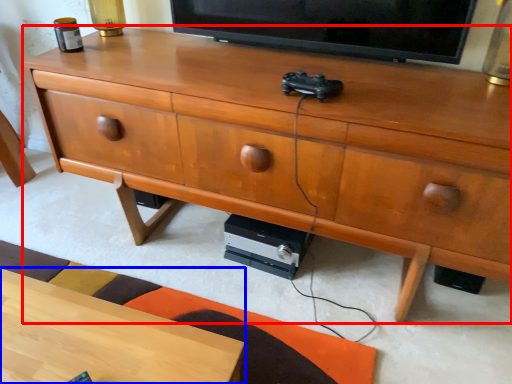
Question: Which object appears closest to the camera in this image, chest of drawers (highlighted by a red box) or desk (highlighted by a blue box)?

Choices:
 (A) chest of drawers
 (B) desk

Answer: (B)